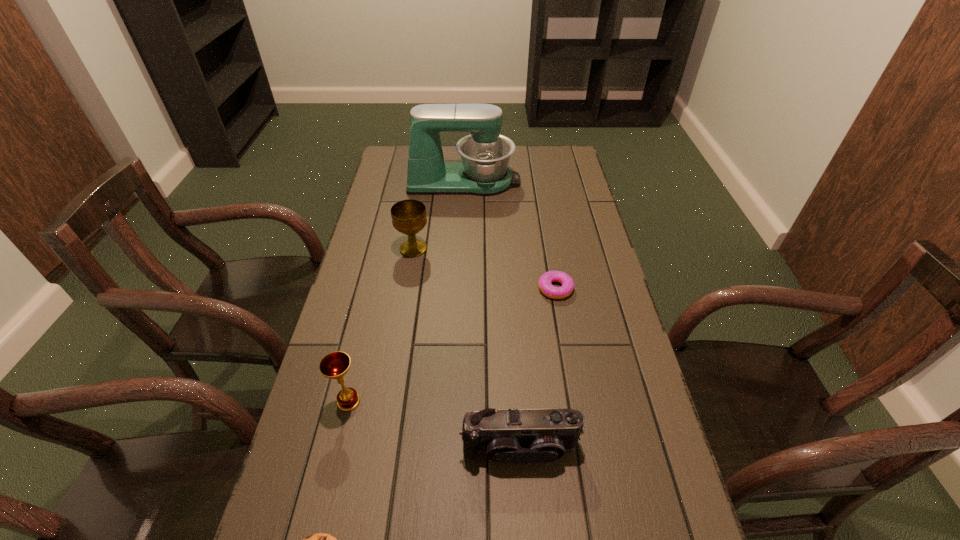
The height and width of the screenshot is (540, 960). Identify the location of free space located 0.190m on the front-facing side of the tallest object. (566, 181).

Image resolution: width=960 pixels, height=540 pixels. In order to click on free space located on the left of the farther chalice in this screenshot , I will do `click(368, 249)`.

The image size is (960, 540). Identify the location of free spot located 0.240m on the back of the left chalice. (369, 317).

Where is `vacant position located 0.060m on the front-facing side of the second nearest object`? The width and height of the screenshot is (960, 540). vacant position located 0.060m on the front-facing side of the second nearest object is located at coordinates (523, 497).

At what (x,y) coordinates should I click in order to perform the action: click on vacant area situated on the back of the fourth nearest object. Please return your answer as a coordinate pair (x, y). Image resolution: width=960 pixels, height=540 pixels. Looking at the image, I should click on (549, 252).

Identify the location of object situated at the far edge. (485, 154).

This screenshot has width=960, height=540. Identify the location of mixer located at the left edge. (485, 154).

Where is `object that is at the right edge`? The width and height of the screenshot is (960, 540). object that is at the right edge is located at coordinates (545, 286).

What are the coordinates of `object that is at the far left corner` in the screenshot? It's located at tap(485, 154).

In the image, there is a desktop. At what (x,y) coordinates should I click in order to perform the action: click on vacant space at the far edge. Please return your answer as a coordinate pair (x, y). The height and width of the screenshot is (540, 960). Looking at the image, I should click on (454, 161).